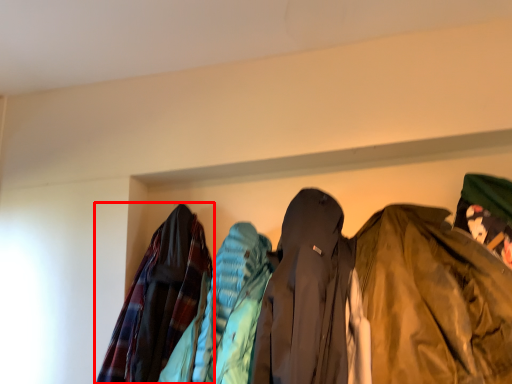
Question: From the image's perspective, what is the correct spatial positioning of jacket (annotated by the red box) in reference to jacket?

Choices:
 (A) above
 (B) below

Answer: (B)